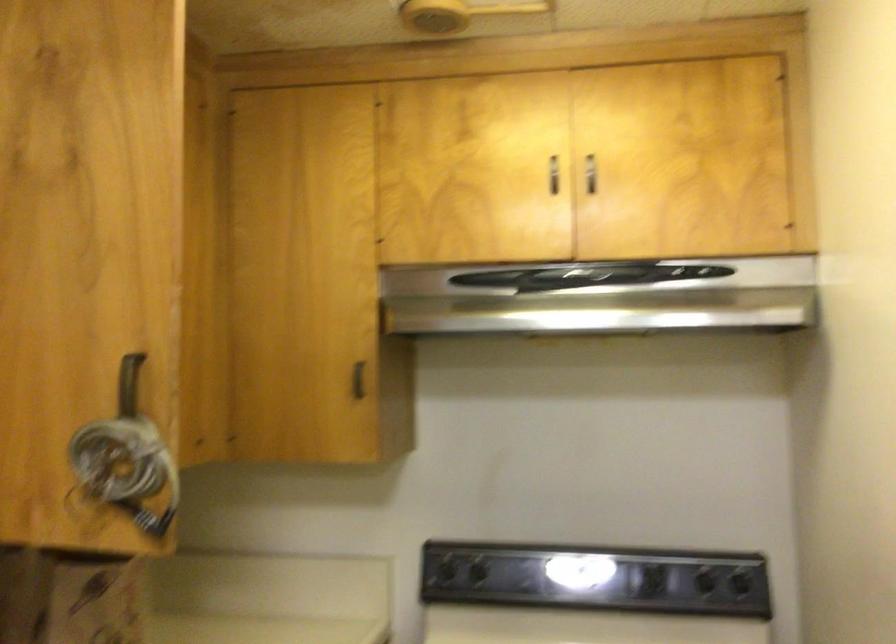
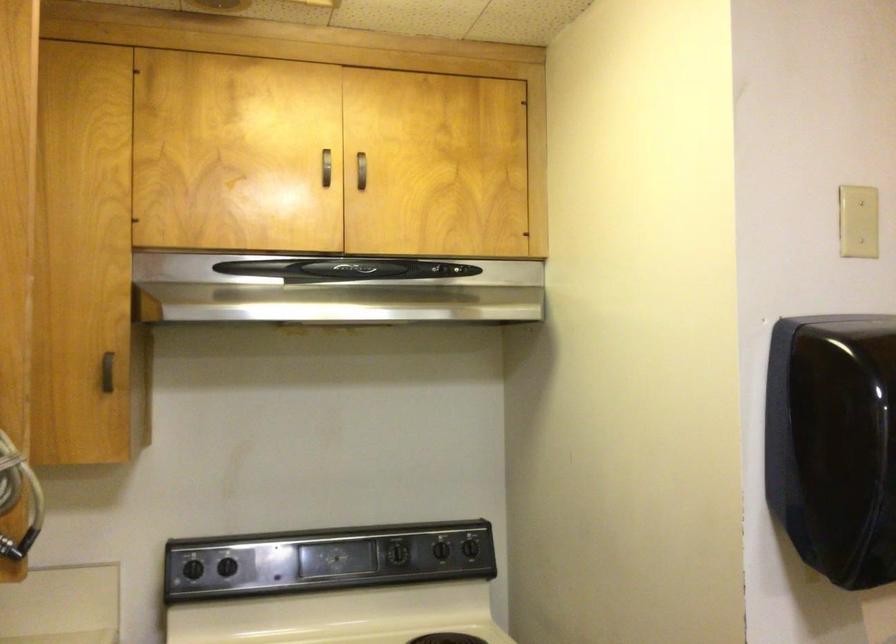
Locate, in the second image, the point that corresponds to point 444,574 in the first image.

(193, 569)